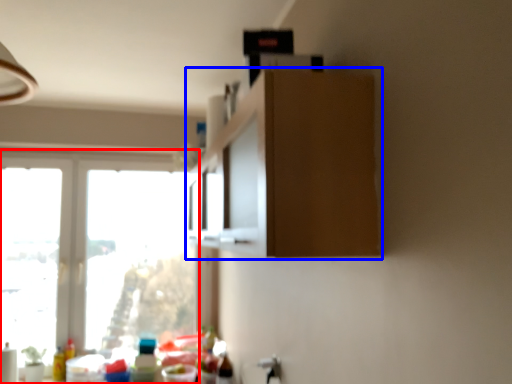
Question: Which object appears farthest to the camera in this image, window (highlighted by a red box) or cabinetry (highlighted by a blue box)?

Choices:
 (A) window
 (B) cabinetry

Answer: (A)